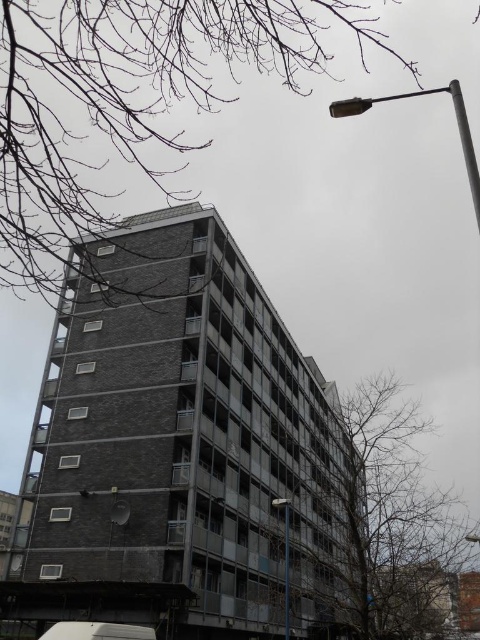
Question: Is metallic pole at upper right wider than metallic pole at center?

Choices:
 (A) yes
 (B) no

Answer: (A)

Question: Can you confirm if metallic pole at upper right is positioned below metallic pole at center?

Choices:
 (A) no
 (B) yes

Answer: (A)

Question: Can you confirm if metallic pole at upper right is positioned to the left of metallic pole at center?

Choices:
 (A) no
 (B) yes

Answer: (A)

Question: Which point appears closest to the camera in this image?

Choices:
 (A) (279, 499)
 (B) (469, 184)

Answer: (A)

Question: Which object appears farthest from the camera in this image?

Choices:
 (A) metallic pole at upper right
 (B) metallic pole at center

Answer: (B)

Question: Which of the following is the closest to the observer?

Choices:
 (A) (457, 113)
 (B) (285, 563)

Answer: (A)